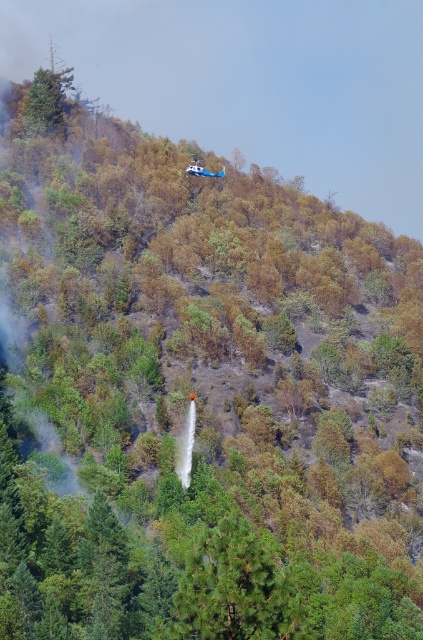
Question: Which point is closer to the camera taking this photo?

Choices:
 (A) (200, 552)
 (B) (55, 122)

Answer: (A)

Question: Is green matte tree at center below green matte tree at upper left?

Choices:
 (A) yes
 (B) no

Answer: (A)

Question: Is green matte tree at center to the right of green matte tree at upper left from the viewer's perspective?

Choices:
 (A) yes
 (B) no

Answer: (A)

Question: Is green matte tree at center behind green matte tree at upper left?

Choices:
 (A) yes
 (B) no

Answer: (B)